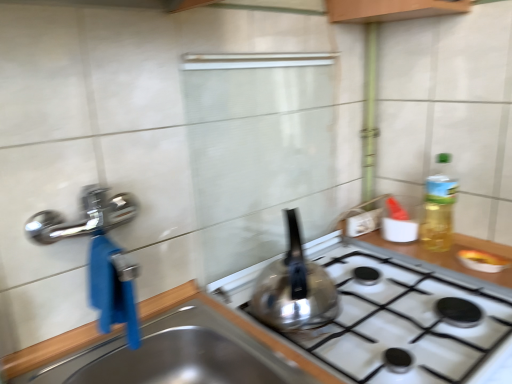
What do you see at coordinates (226, 339) in the screenshot? The height and width of the screenshot is (384, 512). I see `stainless steel sink at lower left` at bounding box center [226, 339].

You are a GUI agent. You are given a task and a screenshot of the screen. Output one action in this format:
    pyautogui.click(x=<x>, y=<y>)
    Task: Click on the stainless steel sink at lower left
    The height and width of the screenshot is (384, 512).
    Given the screenshot: What is the action you would take?
    pyautogui.click(x=226, y=339)

Locate an element on the screen. The width and height of the screenshot is (512, 384). satin silver kettle at center is located at coordinates (294, 288).

What do you see at coordinates (294, 288) in the screenshot? I see `satin silver kettle at center` at bounding box center [294, 288].

At what (x,y) coordinates should I click in order to perform the action: click on stainless steel sink at lower left. Please return your answer as a coordinate pair (x, y). The image size is (512, 384). Looking at the image, I should click on pyautogui.click(x=226, y=339).

Which is more to the right, satin silver kettle at center or stainless steel sink at lower left?

Positioned to the right is satin silver kettle at center.

Does satin silver kettle at center come in front of stainless steel sink at lower left?

No, it is behind stainless steel sink at lower left.

Which point is more distant from viewer, (286, 270) or (44, 381)?

The point (286, 270) is behind.

From the image's perspective, is satin silver kettle at center below stainless steel sink at lower left?

No, from the image's perspective, satin silver kettle at center is not below stainless steel sink at lower left.

From a real-world perspective, is satin silver kettle at center above or below stainless steel sink at lower left?

satin silver kettle at center is situated higher than stainless steel sink at lower left in the real world.

Between satin silver kettle at center and stainless steel sink at lower left, which one has larger width?

stainless steel sink at lower left.

Can you confirm if satin silver kettle at center is shorter than stainless steel sink at lower left?

No, satin silver kettle at center is not shorter than stainless steel sink at lower left.

Considering the relative sizes of satin silver kettle at center and stainless steel sink at lower left in the image provided, is satin silver kettle at center smaller than stainless steel sink at lower left?

Yes, satin silver kettle at center is smaller than stainless steel sink at lower left.

Is stainless steel sink at lower left located within satin silver kettle at center?

That's incorrect, stainless steel sink at lower left is not inside satin silver kettle at center.

Is satin silver kettle at center next to stainless steel sink at lower left?

There is a gap between satin silver kettle at center and stainless steel sink at lower left.

Is satin silver kettle at center positioned with its back to stainless steel sink at lower left?

No.

Where is `sink below the satin silver kettle at center (from a real-world perspective)`? sink below the satin silver kettle at center (from a real-world perspective) is located at coordinates (226, 339).

Consider the image. Is stainless steel sink at lower left to the left or to the right of satin silver kettle at center in the image?

In the image, stainless steel sink at lower left appears on the left side of satin silver kettle at center.

Relative to satin silver kettle at center, is stainless steel sink at lower left in front or behind?

In the image, stainless steel sink at lower left appears in front of satin silver kettle at center.

Which is farther, (x=101, y=345) or (x=290, y=234)?

The point (x=290, y=234) is more distant.

From the image's perspective, which one is positioned lower, stainless steel sink at lower left or satin silver kettle at center?

stainless steel sink at lower left appears lower in the image.

From a real-world perspective, which object rests below the other?

stainless steel sink at lower left, from a real-world perspective.

From the picture: Considering the sizes of objects stainless steel sink at lower left and satin silver kettle at center in the image provided, who is thinner, stainless steel sink at lower left or satin silver kettle at center?

Thinner between the two is satin silver kettle at center.

Does stainless steel sink at lower left have a lesser height compared to satin silver kettle at center?

Yes.

Can you confirm if stainless steel sink at lower left is bigger than satin silver kettle at center?

Indeed, stainless steel sink at lower left has a larger size compared to satin silver kettle at center.

Is stainless steel sink at lower left inside or outside of satin silver kettle at center?

stainless steel sink at lower left is not inside satin silver kettle at center, it's outside.

Is stainless steel sink at lower left positioned far away from satin silver kettle at center?

No, stainless steel sink at lower left is not far from satin silver kettle at center.

Is stainless steel sink at lower left positioned with its back to satin silver kettle at center?

No, stainless steel sink at lower left is not facing the opposite direction of satin silver kettle at center.

The height and width of the screenshot is (384, 512). Identify the location of kitchen appliance above the stainless steel sink at lower left (from the image's perspective). (294, 288).

Where is `kitchen appliance located behind the stainless steel sink at lower left`? The height and width of the screenshot is (384, 512). kitchen appliance located behind the stainless steel sink at lower left is located at coordinates (294, 288).

This screenshot has height=384, width=512. Identify the location of kitchen appliance that appears above the stainless steel sink at lower left (from a real-world perspective). (294, 288).